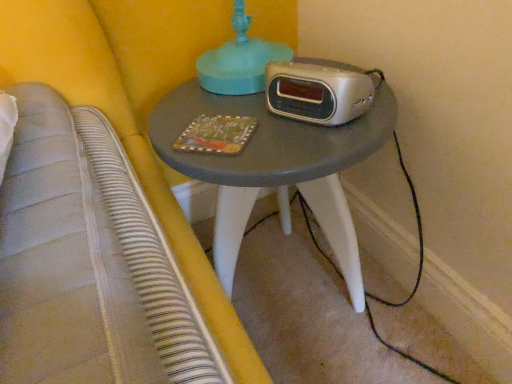
Where is `free space between silver metallic alarm clock at center and wooden painted book at center`? This screenshot has width=512, height=384. free space between silver metallic alarm clock at center and wooden painted book at center is located at coordinates (268, 122).